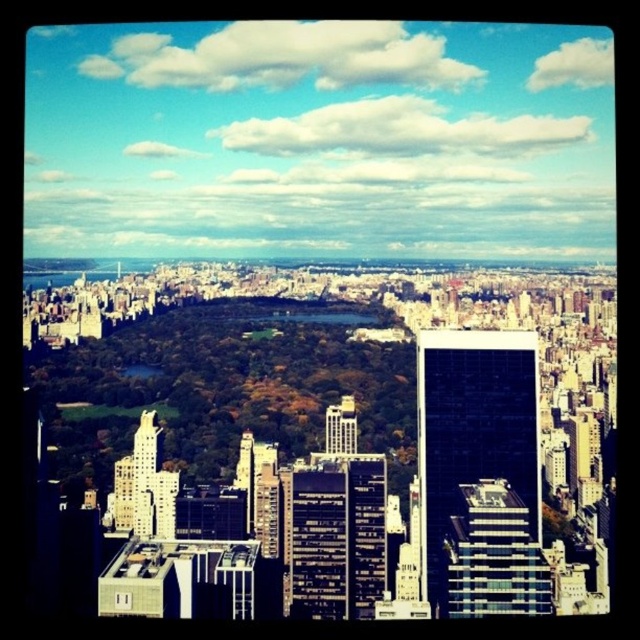
Between white glass building at center and white glass building at center-left, which one is positioned higher?

white glass building at center-left

Between white glass building at center and white glass building at center-left, which one is positioned lower?

white glass building at center is below.

The height and width of the screenshot is (640, 640). In order to click on white glass building at center in this screenshot , I will do `click(492, 556)`.

Does white glass building at center have a lesser width compared to metallic glass skyscraper at center?

In fact, white glass building at center might be wider than metallic glass skyscraper at center.

Which is behind, point (524, 531) or point (346, 442)?

Positioned behind is point (524, 531).

Identify the location of white glass building at center. (492, 556).

Between point (481, 369) and point (147, 506), which one is positioned behind?

The point (147, 506) is more distant.

The height and width of the screenshot is (640, 640). What do you see at coordinates (474, 426) in the screenshot?
I see `black glass building at right` at bounding box center [474, 426].

Identify the location of black glass building at right. pyautogui.click(x=474, y=426).